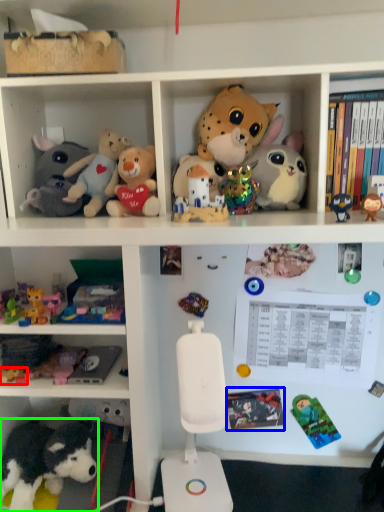
Question: Which object is the closest to the toy (highlighted by a red box)? Choose among these: book (highlighted by a blue box) or toy (highlighted by a green box).

Choices:
 (A) book
 (B) toy

Answer: (B)